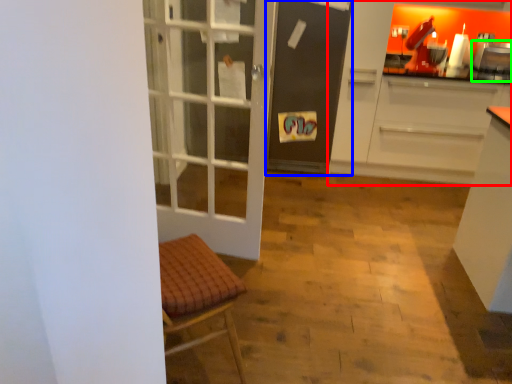
Question: Considering the real-world distances, which object is closest to cabinetry (highlighted by a red box)? screen door (highlighted by a blue box) or appliance (highlighted by a green box).

Choices:
 (A) screen door
 (B) appliance

Answer: (A)